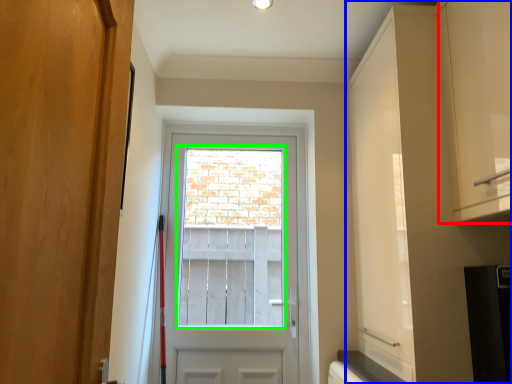
Question: Which object is the closest to the cabinetry (highlighted by a red box)? Choose among these: dresser (highlighted by a blue box) or window screen (highlighted by a green box).

Choices:
 (A) dresser
 (B) window screen

Answer: (A)